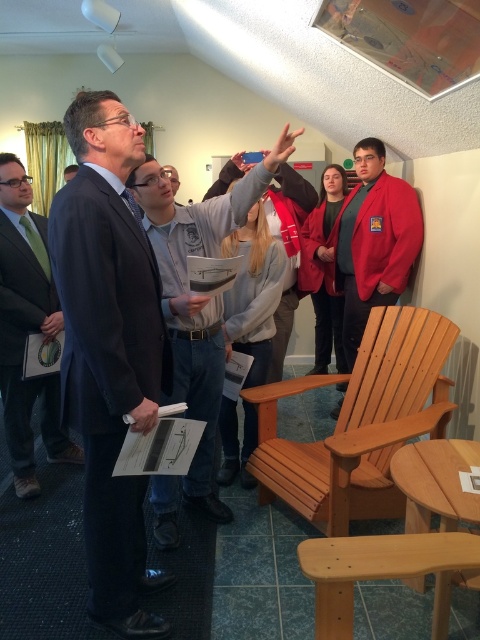
Question: Can you confirm if dark blue suit at center is wider than matte gray sweater at upper center?

Choices:
 (A) yes
 (B) no

Answer: (B)

Question: Which point is closer to the camera?

Choices:
 (A) (469, 564)
 (B) (67, 244)

Answer: (A)

Question: Which object is the farthest from the gray fleece sweatshirt at center?

Choices:
 (A) green silk tie at center
 (B) matte gray sweater at upper center
 (C) light brown wooden chair at lower right

Answer: (A)

Question: Which object is farther from the camera taking this photo?

Choices:
 (A) gray fleece sweatshirt at center
 (B) red jacket at center
 (C) red cotton jacket at right
 (D) dark blue suit at center

Answer: (B)

Question: Does matte gray sweater at upper center lie in front of red cotton jacket at right?

Choices:
 (A) yes
 (B) no

Answer: (A)

Question: Is green silk tie at center thinner than light brown wood chair at lower right?

Choices:
 (A) yes
 (B) no

Answer: (A)